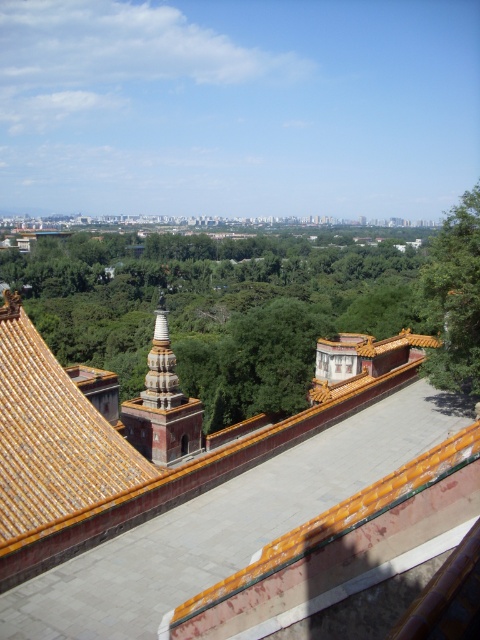
You are an architect planning to install a new decorative element between the golden glazed tiles at center and the white stone stupa at center. Which object should the new element be placed closer to if it needs to be positioned at a height of 2 meters?

The new decorative element should be placed closer to the golden glazed tiles at center because it is shorter than the white stone stupa at center, so positioning it near the shorter object would allow it to be at 2 meters height more appropriately.

You are standing at the top of the orange tiled roof structure and looking out. There is a point marked at coordinates (52, 442). What is located at that point?

The point at coordinates (52, 442) indicates gold glazed tiles at center.

You are a drone operator tasked with capturing aerial footage of the gold glazed tiles at center and the orange glazed stupa at center. The minimum safe distance between the drone and any structure is 50 feet. Can you safely fly the drone between these two structures?

The distance between the gold glazed tiles at center and the orange glazed stupa at center is 54.28 feet, which exceeds the minimum safe distance of 50 feet. Therefore, it is safe to fly the drone between these two structures.